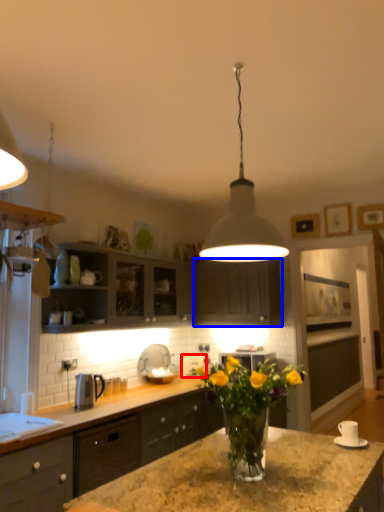
Question: Which of the following is the closest to the observer, appliance (highlighted by a red box) or cabinetry (highlighted by a blue box)?

Choices:
 (A) appliance
 (B) cabinetry

Answer: (B)